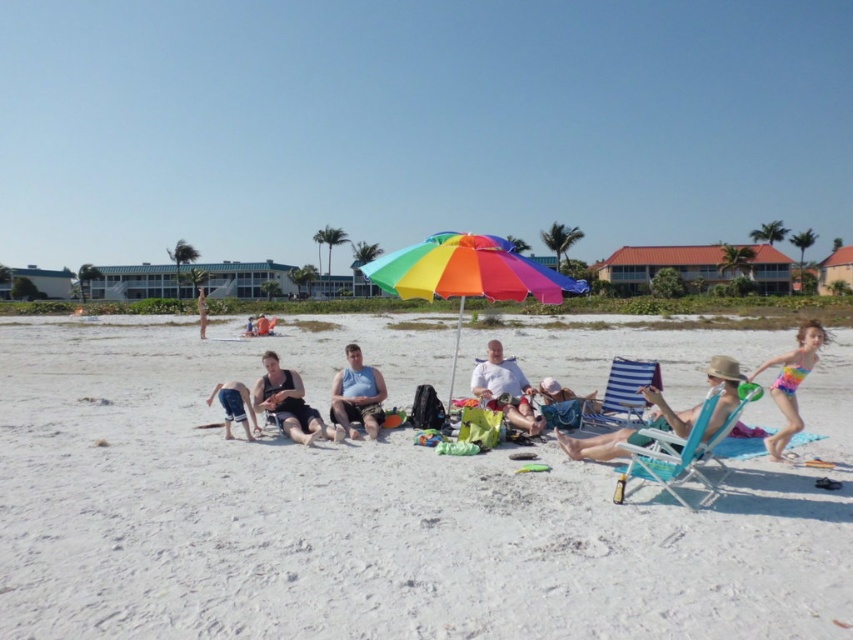
Question: Does matte blue tank top at center have a smaller size compared to striped fabric beach chair at center?

Choices:
 (A) yes
 (B) no

Answer: (B)

Question: Which of the following is the farthest from the observer?

Choices:
 (A) matte black tank top at center
 (B) teal fabric beach chair at center
 (C) matte blue tank top at center
 (D) rainbow umbrella at center

Answer: (D)

Question: Among these points, which one is farthest from the camera?

Choices:
 (A) (671, 438)
 (B) (25, 330)
 (C) (320, 422)
 (D) (204, 332)

Answer: (B)

Question: Based on their relative distances, which object is nearer to the rainbow fabric umbrella at center?

Choices:
 (A) matte black shorts at center
 (B) matte blue shorts at center
 (C) striped fabric beach chair at center

Answer: (B)

Question: Does rainbow swimsuit at right appear on the right side of matte blue tank top at center?

Choices:
 (A) no
 (B) yes

Answer: (B)

Question: Is matte black tank top at center further to camera compared to matte blue shorts at center?

Choices:
 (A) no
 (B) yes

Answer: (A)